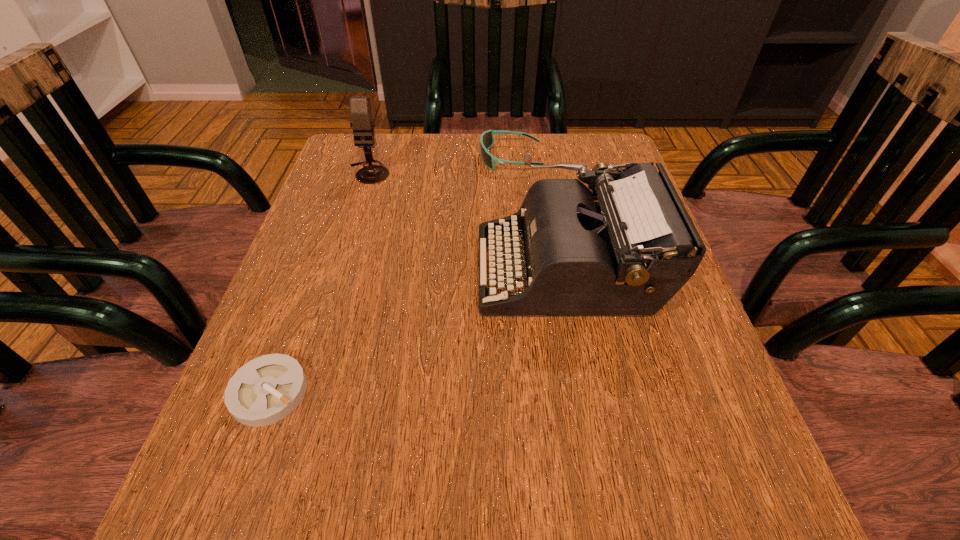
Identify the location of free space that is in between the typewriter and the microphone. [468, 221].

Find the location of `free point between the ashtray and the second nearest object`. free point between the ashtray and the second nearest object is located at coordinates (x=419, y=330).

In order to click on unoccupied area between the typewriter and the microphone in this screenshot , I will do `click(468, 221)`.

Identify the location of the third closest object to the third tallest object. This screenshot has height=540, width=960. (265, 390).

I want to click on object that can be found as the third closest to the shortest object, so click(487, 138).

Locate an element on the screen. free spot that satisfies the following two spatial constraints: 1. on the front-facing side of the second shortest object; 2. on the front-facing side of the microphone is located at coordinates (513, 172).

Locate an element on the screen. The width and height of the screenshot is (960, 540). vacant space that satisfies the following two spatial constraints: 1. on the front-facing side of the third tallest object; 2. on the front-facing side of the microphone is located at coordinates (513, 172).